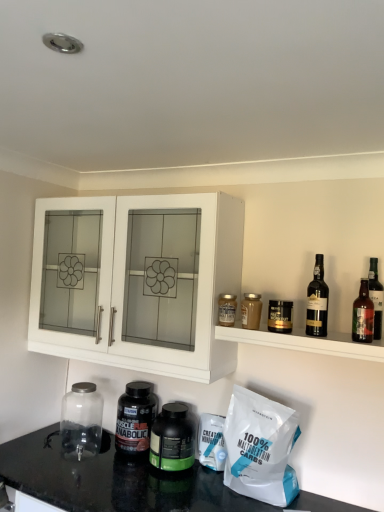
Question: Considering the positions of point (125, 418) and point (258, 461), is point (125, 418) closer or farther from the camera than point (258, 461)?

Choices:
 (A) closer
 (B) farther

Answer: (B)

Question: From a real-world perspective, is black plastic bottle at lower center, which ranks as the fifth bottle in right-to-left order, positioned above or below white matte bag of 100% maltodextrin carbs at lower right?

Choices:
 (A) above
 (B) below

Answer: (B)

Question: Based on their relative distances, which object is nearer to the matte glass shelf at upper right?

Choices:
 (A) translucent glass jar at shelf right, which ranks as the second bottle in right-to-left order
 (B) dark glass bottle at shelf right
 (C) transparent glass jar at lower left
 (D) green matte bottle at center, the 5th bottle viewed from the top
 (E) brown glass bottle at right

Answer: (B)

Question: Based on their relative distances, which object is farther from the white matte bag of 100% maltodextrin carbs at lower right?

Choices:
 (A) transparent glass jar at lower left
 (B) black plastic jar at upper right, marked as the first bottle in a right-to-left arrangement
 (C) matte glass shelf at upper right
 (D) dark glass bottle at shelf right
 (E) white matte cabinet at upper left

Answer: (A)